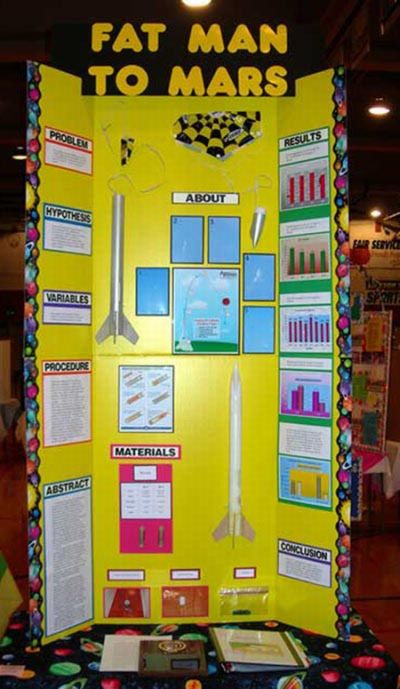
Image resolution: width=400 pixels, height=689 pixels. In order to click on yellow poster in this screenshot , I will do `click(204, 488)`.